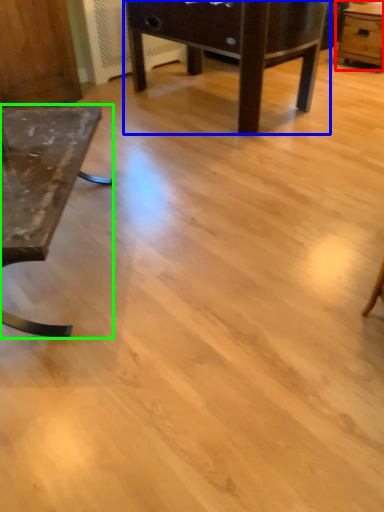
Question: Which object is positioned closest to table (highlighted by a red box)? Select from table (highlighted by a blue box) and table (highlighted by a green box).

Choices:
 (A) table
 (B) table

Answer: (A)